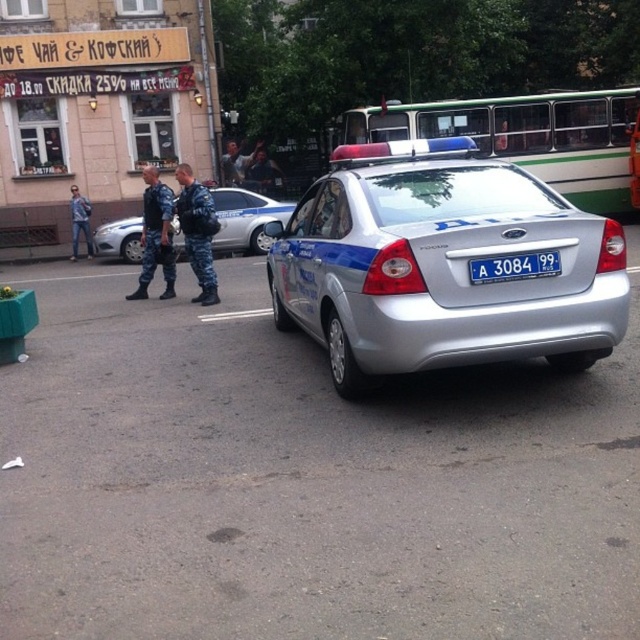
Question: Among these objects, which one is nearest to the camera?

Choices:
 (A) camouflage uniform at center
 (B) silver metallic police car at center

Answer: (B)

Question: Estimate the real-world distances between objects in this image. Which object is closer to the green and white bus at upper center?

Choices:
 (A) camouflage uniform pants at center
 (B) camouflage uniform at center

Answer: (B)

Question: Among these objects, which one is farthest from the camera?

Choices:
 (A) camouflage uniform at center
 (B) silver metallic sedan at center
 (C) camouflage uniform pants at center

Answer: (B)

Question: Does silver metallic sedan at center have a greater width compared to camouflage uniform at center?

Choices:
 (A) no
 (B) yes

Answer: (B)

Question: Can you confirm if white plastic license plate at center is positioned to the right of denim jacket at left?

Choices:
 (A) no
 (B) yes

Answer: (B)

Question: Does silver metallic police car at center lie in front of green and white bus at upper center?

Choices:
 (A) yes
 (B) no

Answer: (A)